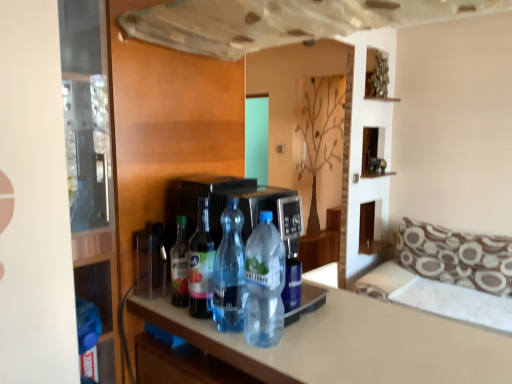
This screenshot has height=384, width=512. Find the location of `spots to the right of clear plastic bottle at center, acting as the fourth bottle starting from the left`. spots to the right of clear plastic bottle at center, acting as the fourth bottle starting from the left is located at coordinates (331, 340).